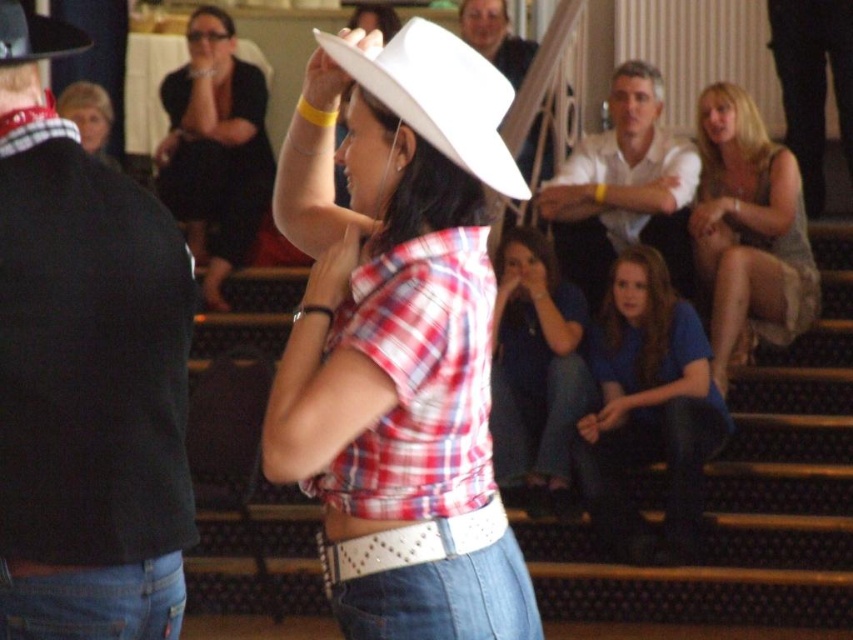
You are a photographer at the event and want to capture a photo that includes both the white cotton shirt at upper center and the denim at lower right. Which object should you focus on first to ensure both are in the frame?

The white cotton shirt at upper center is located above denim at lower right, so you should focus on the white cotton shirt at upper center first to ensure both are in the frame.

In the scene shown: You are at a social event and want to move from the black felt fedora at upper left to the blue denim jeans at lower center. Which direction should you move in?

The black felt fedora at upper left is behind the blue denim jeans at lower center, so you should move forward to reach the blue denim jeans at lower center from the black felt fedora at upper left.

You are a photographer at the event and want to capture a photo where the white cotton shirt at upper center and denim at lower right are both visible. Based on their heights, which object should you focus on to ensure both are in frame?

The white cotton shirt at upper center is much taller than denim at lower right, so focusing on the white cotton shirt at upper center would ensure both are visible in the photo.